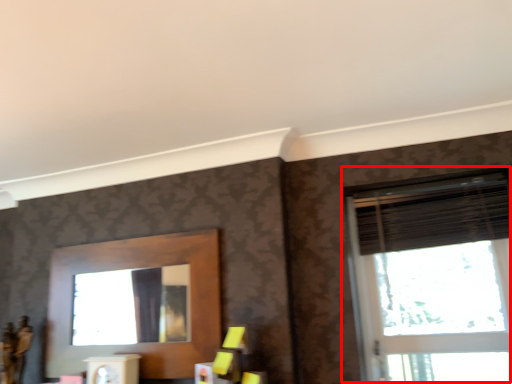
Question: From the image's perspective, what is the correct spatial relationship of window (annotated by the red box) in relation to blind?

Choices:
 (A) above
 (B) below

Answer: (B)